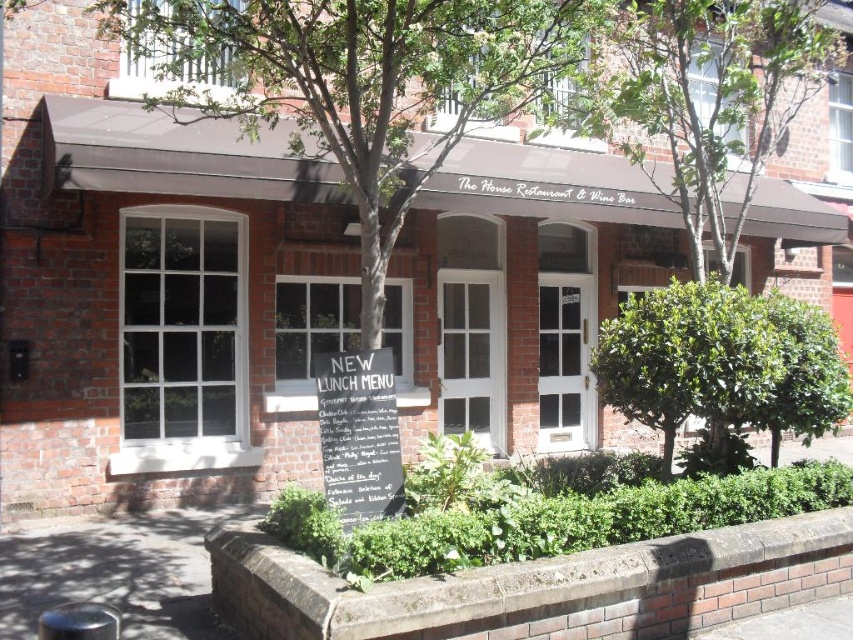
Question: From the image, what is the correct spatial relationship of green leafy bush at center in relation to white chalkboard sign at center?

Choices:
 (A) left
 (B) right

Answer: (B)

Question: From the image, what is the correct spatial relationship of white chalkboard sign at center in relation to shiny metallic stool at lower left?

Choices:
 (A) below
 (B) above

Answer: (B)

Question: Which point appears closest to the camera in this image?

Choices:
 (A) (44, 637)
 (B) (323, 445)
 (C) (747, 365)

Answer: (A)

Question: Which of the following is the closest to the observer?

Choices:
 (A) white chalkboard sign at center
 (B) green leafy bush at center

Answer: (A)

Question: Which of the following is the closest to the observer?

Choices:
 (A) (88, 604)
 (B) (352, 400)
 (C) (842, 420)

Answer: (A)

Question: Can you confirm if white chalkboard sign at center is positioned to the left of shiny metallic stool at lower left?

Choices:
 (A) yes
 (B) no

Answer: (B)